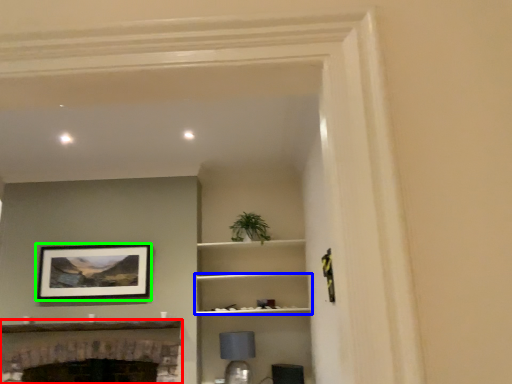
Question: Which object is the closest to the fireplace (highlighted by a red box)? Choose among these: shelf (highlighted by a blue box) or picture frame (highlighted by a green box).

Choices:
 (A) shelf
 (B) picture frame

Answer: (B)